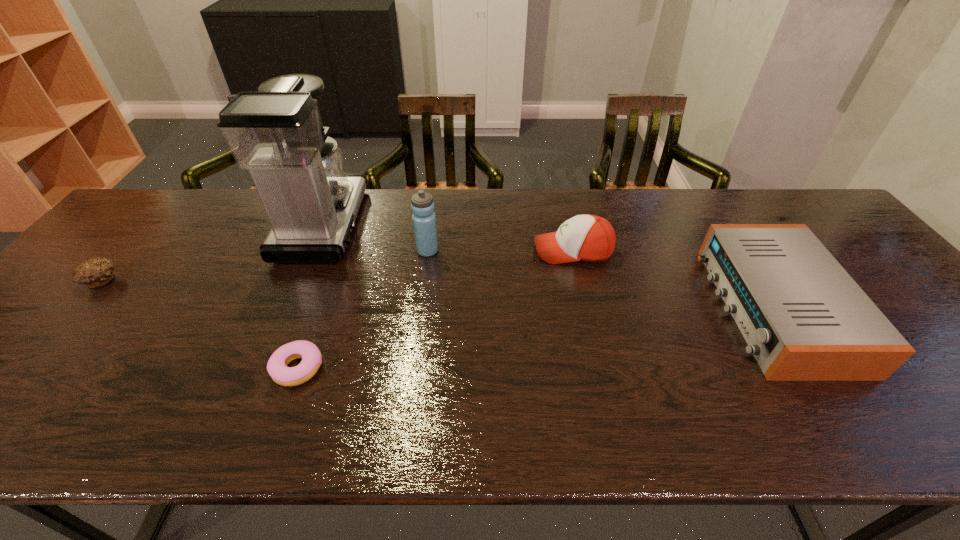
At what (x,y) coordinates should I click in order to perform the action: click on vacant region located on the front-facing side of the baseball cap. Please return your answer as a coordinate pair (x, y). The width and height of the screenshot is (960, 540). Looking at the image, I should click on (442, 251).

I want to click on vacant space positioned 0.230m on the front-facing side of the baseball cap, so [x=452, y=251].

I want to click on vacant region located 0.090m on the front-facing side of the baseball cap, so click(502, 251).

This screenshot has height=540, width=960. I want to click on vacant space situated 0.320m on the front panel of the rightmost object, so click(589, 308).

Find the location of `free location located on the front panel of the rightmost object`. free location located on the front panel of the rightmost object is located at coordinates [662, 308].

Find the location of a particular element. vacant space located on the front panel of the rightmost object is located at coordinates (582, 308).

Identify the location of vacant region located 0.360m on the back of the muffin. (179, 195).

This screenshot has width=960, height=540. What are the coordinates of `free space located on the right of the doughnut` in the screenshot? It's located at (489, 368).

Locate an element on the screen. The height and width of the screenshot is (540, 960). object at the far edge is located at coordinates (311, 203).

At what (x,y) coordinates should I click in order to perform the action: click on object at the left edge. Please return your answer as a coordinate pair (x, y). Image resolution: width=960 pixels, height=540 pixels. Looking at the image, I should click on (96, 272).